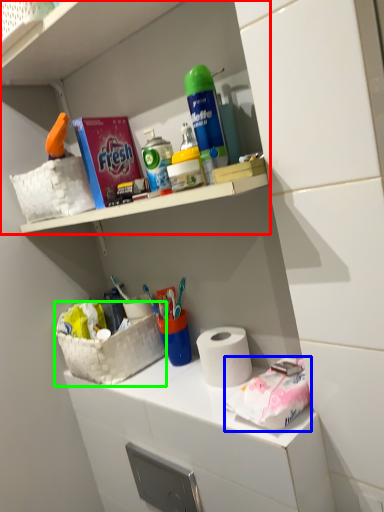
Question: Which object is positioned farthest from shelf (highlighted by a red box)? Select from material (highlighted by a blue box) and basket (highlighted by a green box).

Choices:
 (A) material
 (B) basket

Answer: (A)